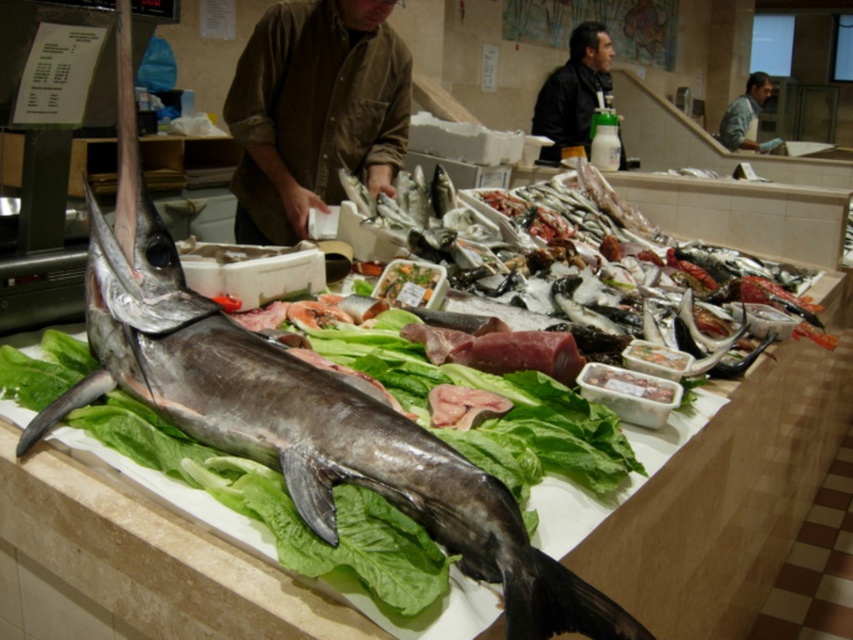
Does dark brown leather jacket at upper center appear on the right side of grayish-blue shirt at upper center?

In fact, dark brown leather jacket at upper center is to the left of grayish-blue shirt at upper center.

Between point (585, 74) and point (744, 90), which one is positioned in front?

Point (585, 74) is more forward.

Is point (583, 72) in front of point (724, 124)?

Yes, it is in front of point (724, 124).

The image size is (853, 640). I want to click on dark brown leather jacket at upper center, so click(x=573, y=92).

Does brown cotton shirt at center appear over dark brown leather jacket at upper center?

No, brown cotton shirt at center is not above dark brown leather jacket at upper center.

Which is more to the left, brown cotton shirt at center or dark brown leather jacket at upper center?

brown cotton shirt at center is more to the left.

Is point (294, 42) closer to camera compared to point (543, 96)?

Yes, point (294, 42) is closer to viewer.

Find the location of a particular element. This screenshot has width=853, height=640. brown cotton shirt at center is located at coordinates (314, 112).

Does brown cotton shirt at center appear over grayish-blue shirt at upper center?

Actually, brown cotton shirt at center is below grayish-blue shirt at upper center.

Looking at this image, can you confirm if brown cotton shirt at center is taller than grayish-blue shirt at upper center?

No, brown cotton shirt at center is not taller than grayish-blue shirt at upper center.

Is point (289, 3) positioned after point (746, 129)?

No, it is not.

Image resolution: width=853 pixels, height=640 pixels. I want to click on brown cotton shirt at center, so click(x=314, y=112).